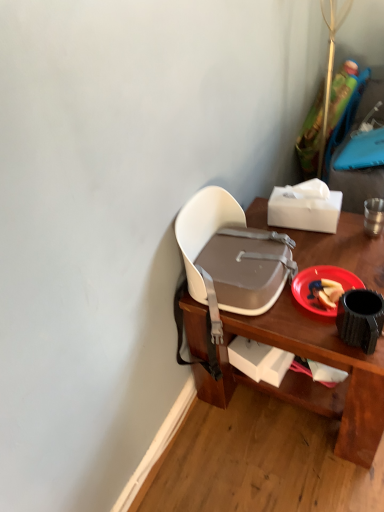
I want to click on free spot below red plastic plate at lower right (from a real-world perspective), so click(x=321, y=289).